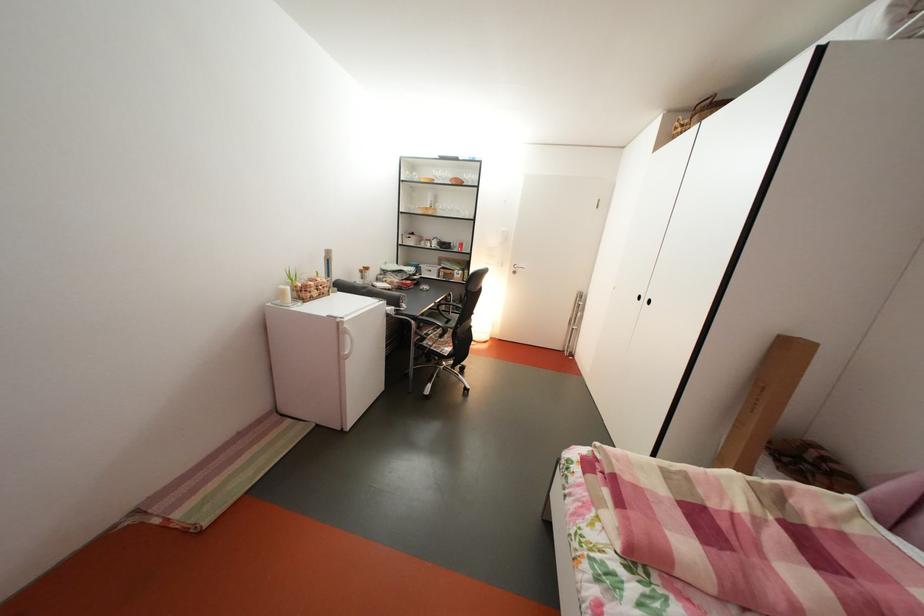
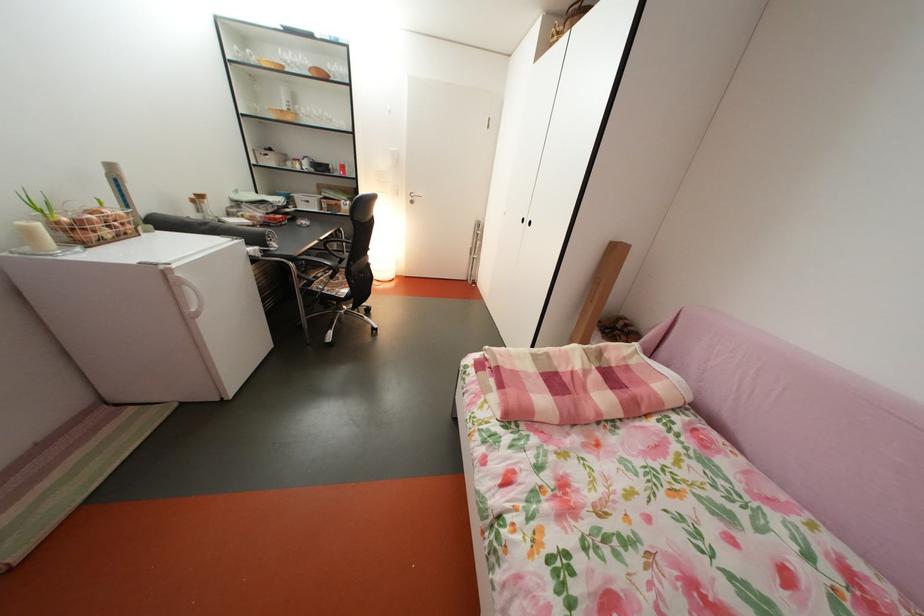
Where in the second image is the point corresponding to point (426, 323) from the first image?

(304, 265)